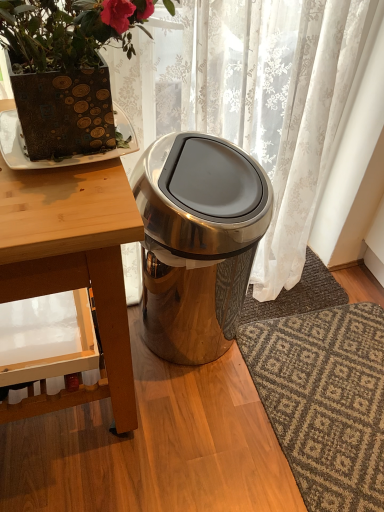
Find the location of a particular element. free spot above dark gray textured rug at lower right, which ranks as the second doormat in bottom-to-top order (from a real-world perspective) is located at coordinates (283, 287).